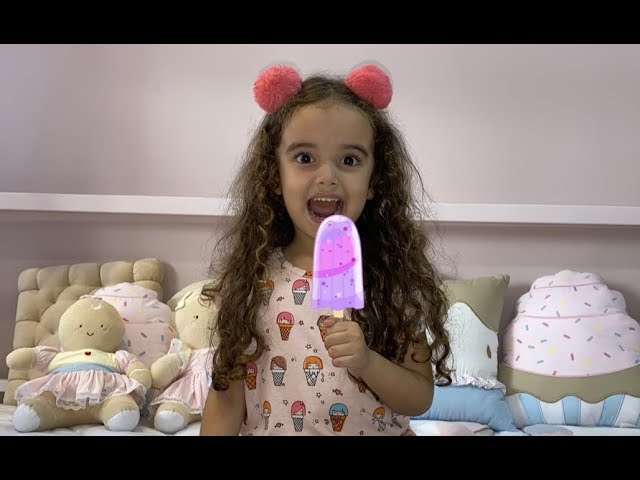
Where is `doll plush`? The image size is (640, 480). doll plush is located at coordinates (95, 355), (200, 344).